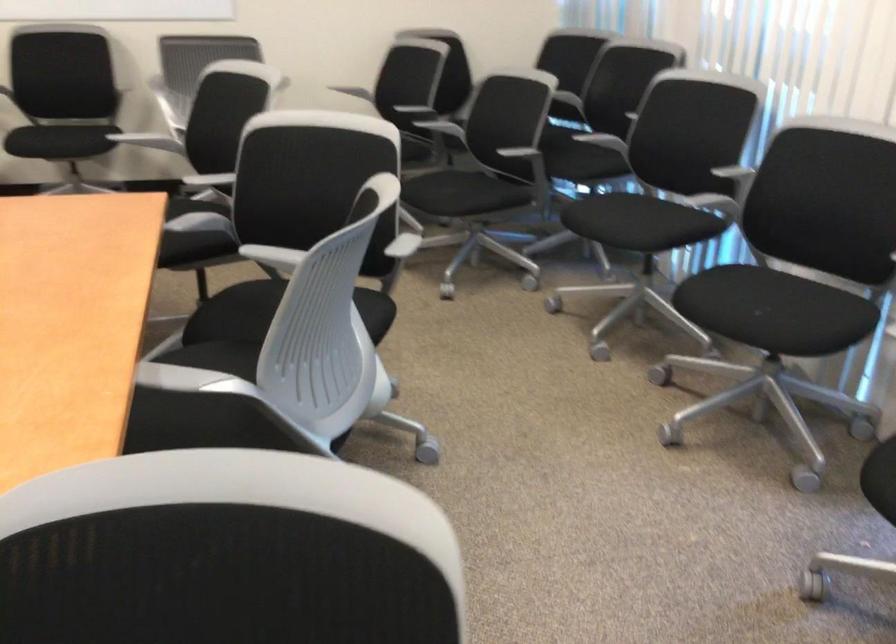
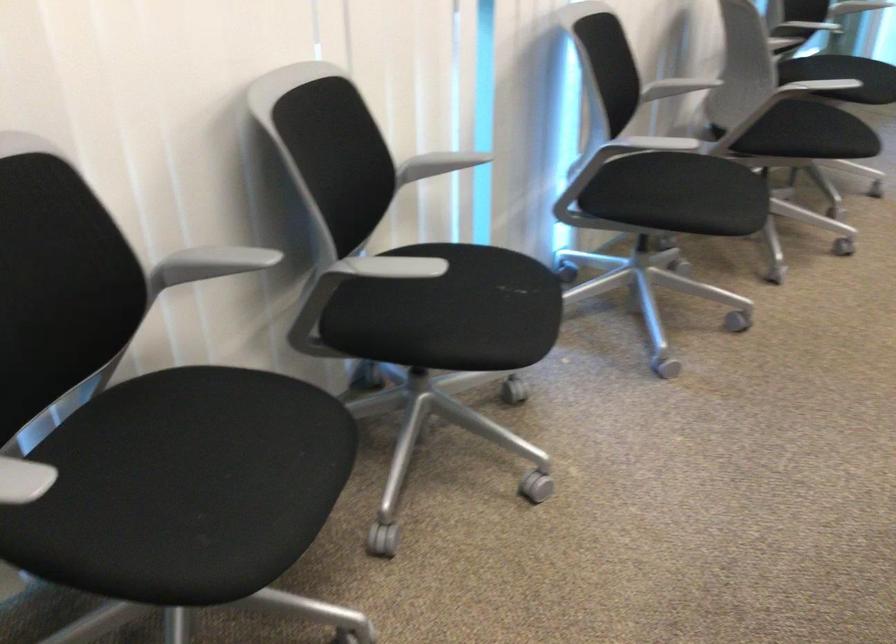
Find the pixel in the second image that matches the point at 627,216 in the first image.

(226, 456)